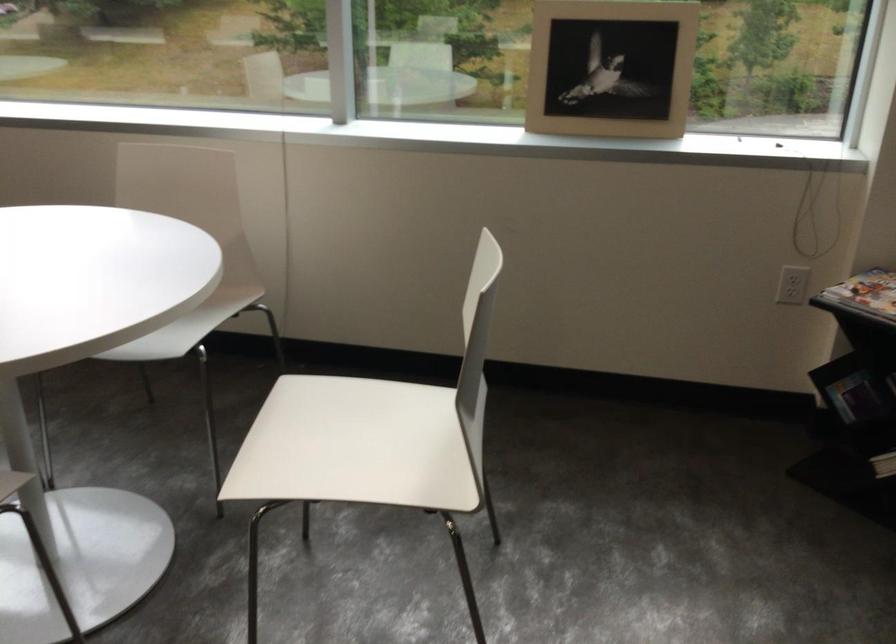
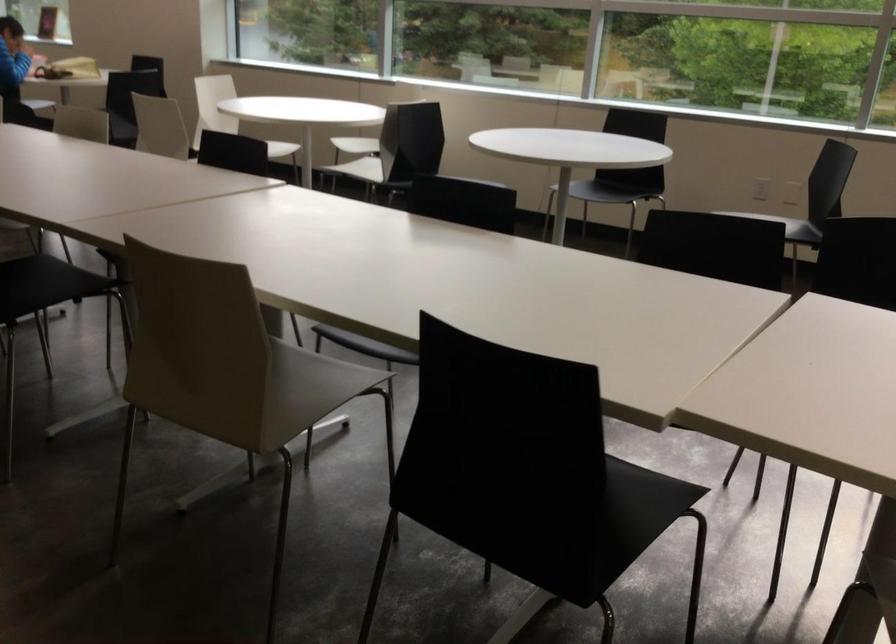
What movement of the cameraman would produce the second image?

The cameraman walked toward left, backward.